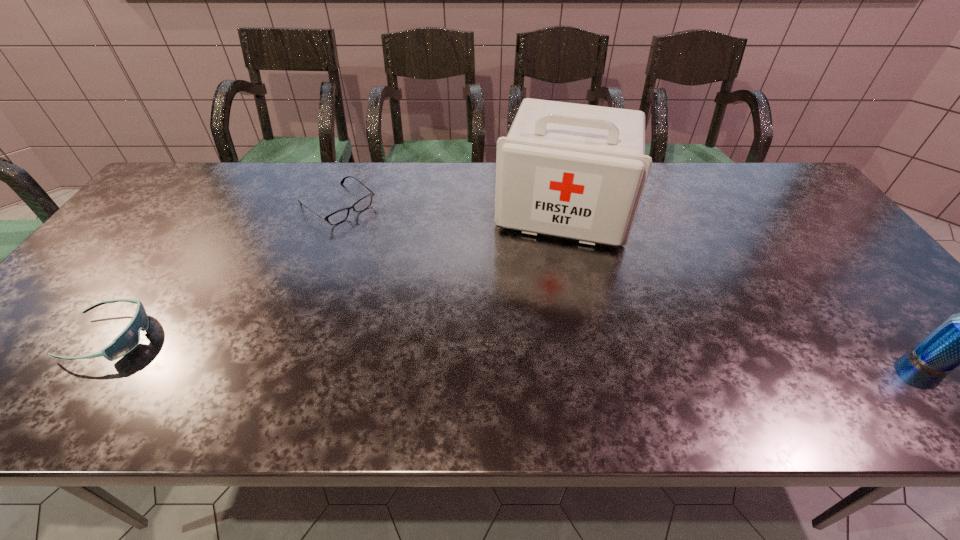
Locate an element on the screen. This screenshot has width=960, height=540. free region located on the front-facing side of the second object from right to left is located at coordinates (527, 359).

Find the location of a particular element. The width and height of the screenshot is (960, 540). vacant space located on the front-facing side of the second object from right to left is located at coordinates (529, 352).

You are a GUI agent. You are given a task and a screenshot of the screen. Output one action in this format:
    pyautogui.click(x=<x>, y=<y>)
    Task: Click on the vacant area situated 0.120m on the front-facing side of the second object from right to left
    This screenshot has width=960, height=540.
    Given the screenshot: What is the action you would take?
    pyautogui.click(x=544, y=281)

The image size is (960, 540). Identify the location of spectacles that is at the far edge. (339, 216).

This screenshot has height=540, width=960. I want to click on the first-aid kit that is at the far edge, so click(x=577, y=171).

In order to click on object that is at the near edge in this screenshot , I will do `click(128, 339)`.

At what (x,y) coordinates should I click in order to perform the action: click on object located in the left edge section of the desktop. Please return your answer as a coordinate pair (x, y). This screenshot has height=540, width=960. Looking at the image, I should click on (128, 339).

The image size is (960, 540). I want to click on object that is at the near left corner, so click(x=128, y=339).

In the image, there is a desktop. Where is `vacant space at the far edge`? vacant space at the far edge is located at coordinates (262, 191).

The height and width of the screenshot is (540, 960). In order to click on free location at the left edge in this screenshot , I will do `click(118, 272)`.